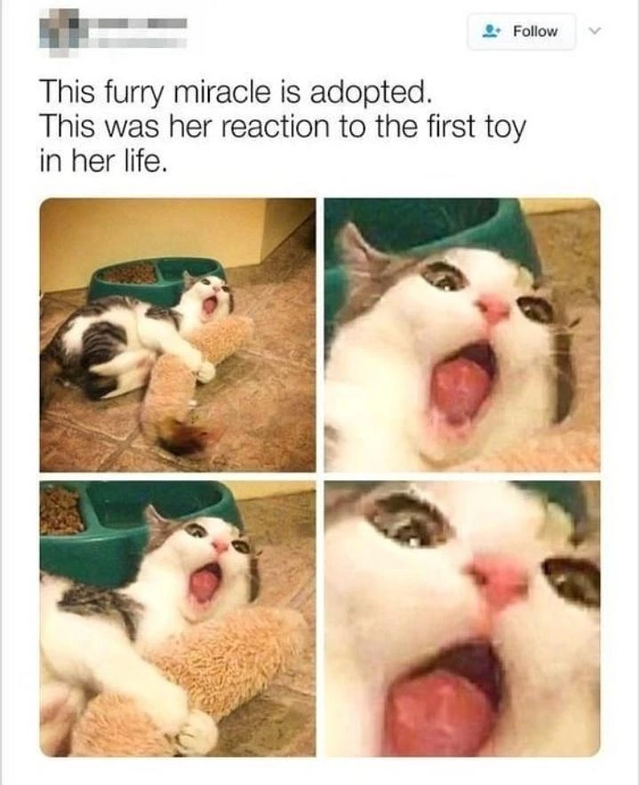
At what (x,y) coordinates should I click in order to perform the action: click on bowl. Please return your answer as a coordinate pair (x, y). Looking at the image, I should click on (95, 526), (161, 280), (459, 218), (568, 494).